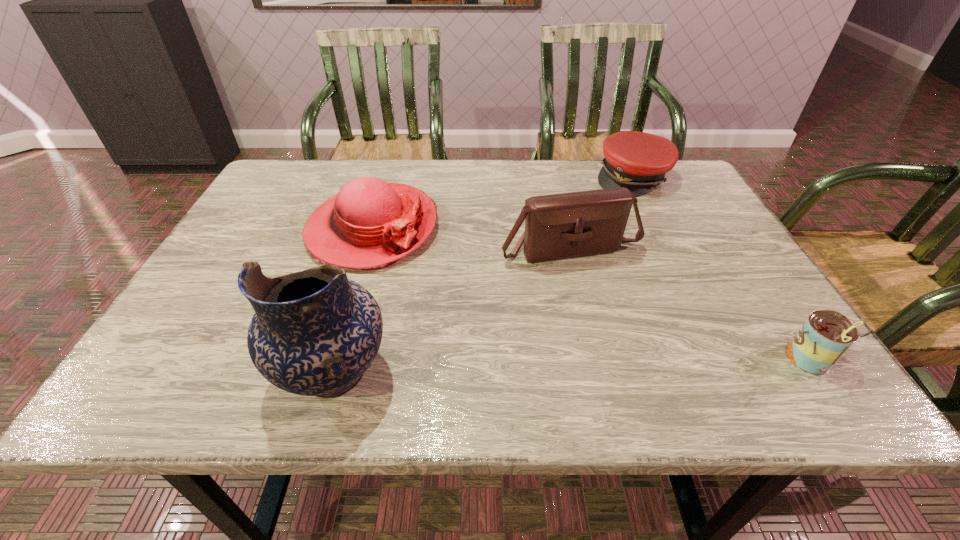
The height and width of the screenshot is (540, 960). Identify the location of vacant space located 0.220m on the front flap of the shoulder bag. (635, 341).

Locate an element on the screen. The image size is (960, 540). vacant region located on the front flap of the shoulder bag is located at coordinates (628, 329).

The image size is (960, 540). I want to click on vacant area situated 0.240m on the front flap of the shoulder bag, so click(x=639, y=349).

This screenshot has height=540, width=960. I want to click on free region located on the front of the cap with an emblem, so click(x=622, y=205).

Where is `vacant area situated on the front of the cap with an emblem`? vacant area situated on the front of the cap with an emblem is located at coordinates (617, 217).

Locate an element on the screen. vacant space located 0.250m on the front of the cap with an emblem is located at coordinates (606, 248).

Find the location of a particular element. hat at the far edge is located at coordinates (370, 223).

The height and width of the screenshot is (540, 960). What are the coordinates of `cap that is positioned at the far edge` in the screenshot? It's located at (638, 161).

At what (x,y) coordinates should I click in order to perform the action: click on pottery that is at the near edge. Please return your answer as a coordinate pair (x, y). The width and height of the screenshot is (960, 540). Looking at the image, I should click on (315, 332).

Locate an element on the screen. This screenshot has width=960, height=540. can present at the near edge is located at coordinates (826, 335).